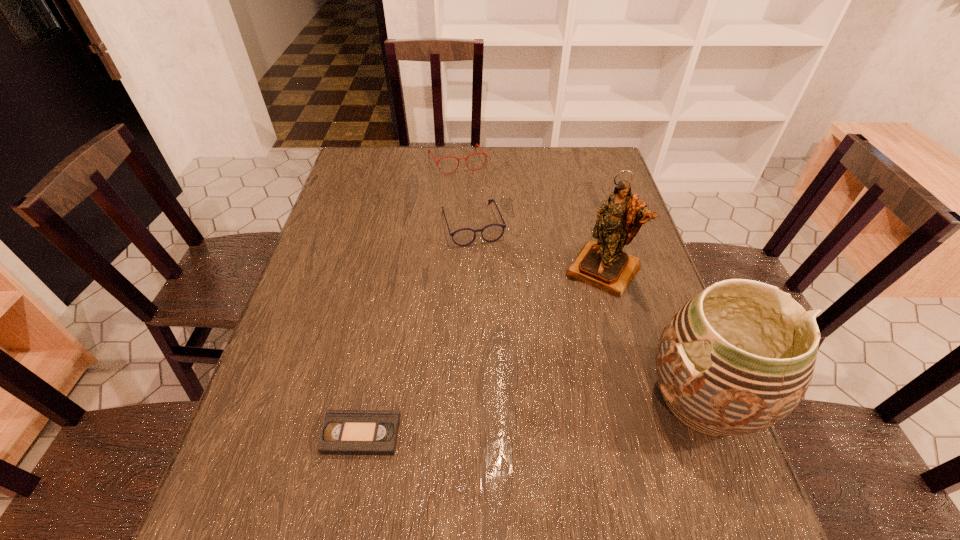
At what (x,y) coordinates should I click in order to perform the action: click on pottery present at the right edge. Please return your answer as a coordinate pair (x, y). The image size is (960, 540). Looking at the image, I should click on (738, 357).

Image resolution: width=960 pixels, height=540 pixels. I want to click on figurine present at the right edge, so click(x=603, y=264).

You are a GUI agent. You are given a task and a screenshot of the screen. Output one action in this format:
    pyautogui.click(x=<x>, y=<y>)
    Task: Click on the object at the near left corner
    
    Given the screenshot: What is the action you would take?
    pyautogui.click(x=344, y=432)

Find the location of a particular element. object present at the near right corner is located at coordinates (738, 357).

Identify the location of free space at the far edge of the desktop. (542, 166).

This screenshot has width=960, height=540. I want to click on free spot at the left edge of the desktop, so click(x=344, y=212).

Where is `free space at the right edge of the desktop`? This screenshot has width=960, height=540. free space at the right edge of the desktop is located at coordinates (641, 356).

The height and width of the screenshot is (540, 960). In the image, there is a desktop. Find the location of `vacant space at the far left corner`. vacant space at the far left corner is located at coordinates 347,181.

Locate an element on the screen. This screenshot has height=540, width=960. vacant space at the far right corner of the desktop is located at coordinates (593, 160).

Locate an element on the screen. free spot between the videotape and the nearer spectacles is located at coordinates (417, 329).